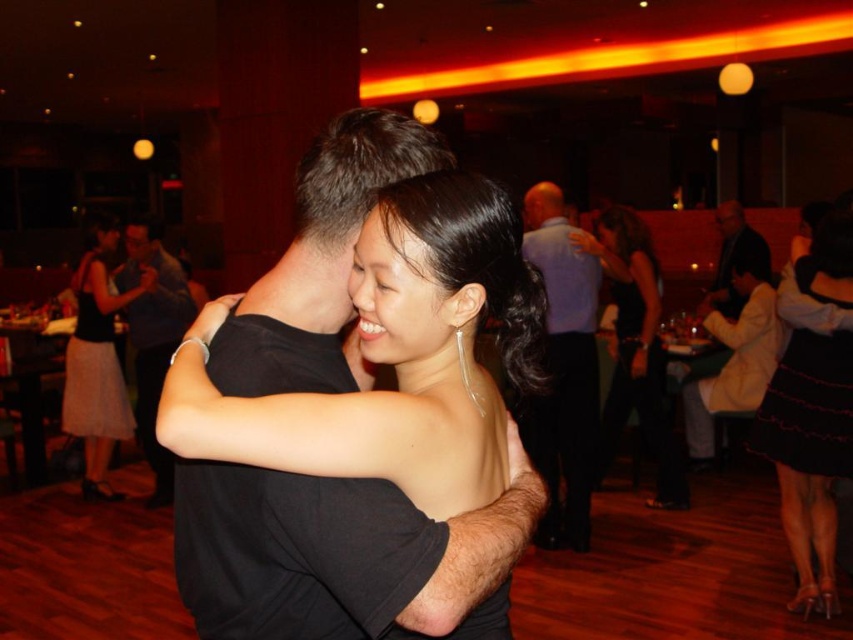
Question: Which object is positioned farthest from the dark gray suit at right?

Choices:
 (A) light blue shirt at upper right
 (B) satin black dress at center
 (C) black satin dress at center
 (D) black matte shirt at center

Answer: (B)

Question: Is the position of light blue shirt at upper right less distant than that of light pink textured skirt at left?

Choices:
 (A) no
 (B) yes

Answer: (B)

Question: Which of the following is the farthest from the observer?

Choices:
 (A) black matte shirt at center
 (B) black satin dress at lower right

Answer: (A)

Question: Is light blue shirt at upper right positioned at the back of black satin dress at center?

Choices:
 (A) no
 (B) yes

Answer: (A)

Question: Which point is closer to the camera taking this photo?

Choices:
 (A) (724, 252)
 (B) (827, 388)
 (C) (180, 316)
 (D) (595, 312)

Answer: (B)

Question: Does light pink textured skirt at left appear over dark gray suit at right?

Choices:
 (A) no
 (B) yes

Answer: (A)